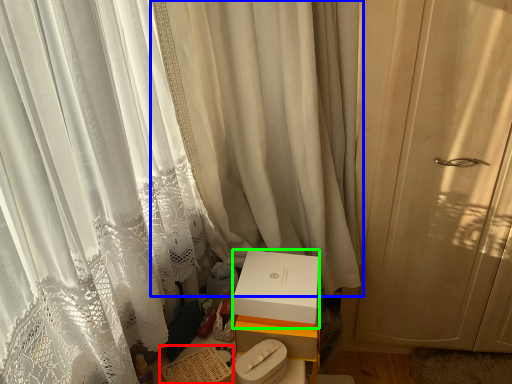
Question: Based on their relative distances, which object is farther from basket (highlighted by a red box)? Choose from curtain (highlighted by a blue box) and box (highlighted by a green box).

Choices:
 (A) curtain
 (B) box

Answer: (A)